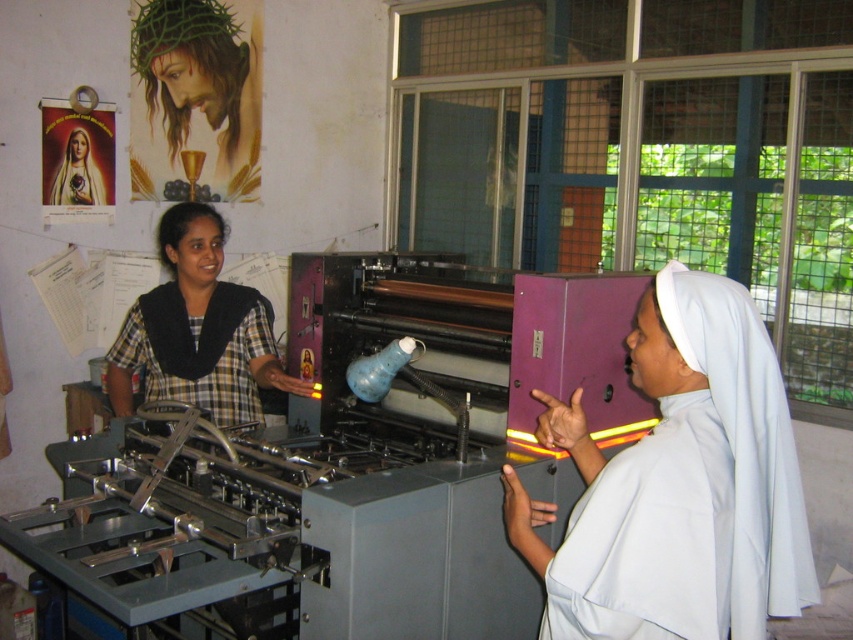
Question: Which point appears farthest from the camera in this image?

Choices:
 (A) (199, 35)
 (B) (77, 186)
 (C) (224, 410)

Answer: (A)

Question: Which object is closer to the camera taking this photo?

Choices:
 (A) black checkered shirt at left
 (B) matte black nun at upper left
 (C) white matte nun's habit at center

Answer: (C)

Question: Is white matte nun's habit at center further to camera compared to black checkered shirt at left?

Choices:
 (A) yes
 (B) no

Answer: (B)

Question: Is black checkered shirt at left wider than matte black blouse at center?

Choices:
 (A) yes
 (B) no

Answer: (A)

Question: Can you confirm if white matte nun's habit at center is thinner than matte black blouse at center?

Choices:
 (A) yes
 (B) no

Answer: (B)

Question: Which object is the farthest from the matte black blouse at center?

Choices:
 (A) matte black nun at upper left
 (B) white matte nun's habit at center
 (C) black checkered shirt at left

Answer: (B)